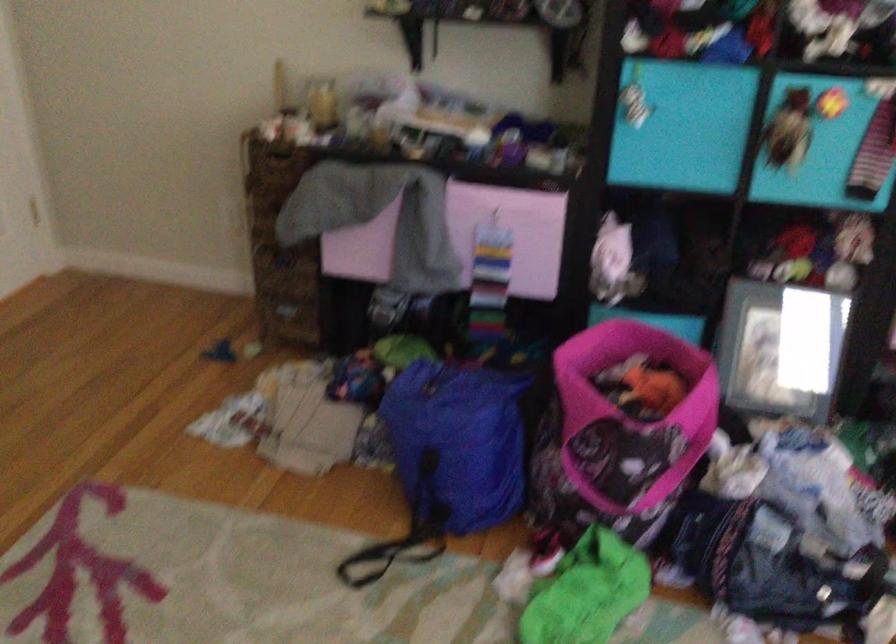
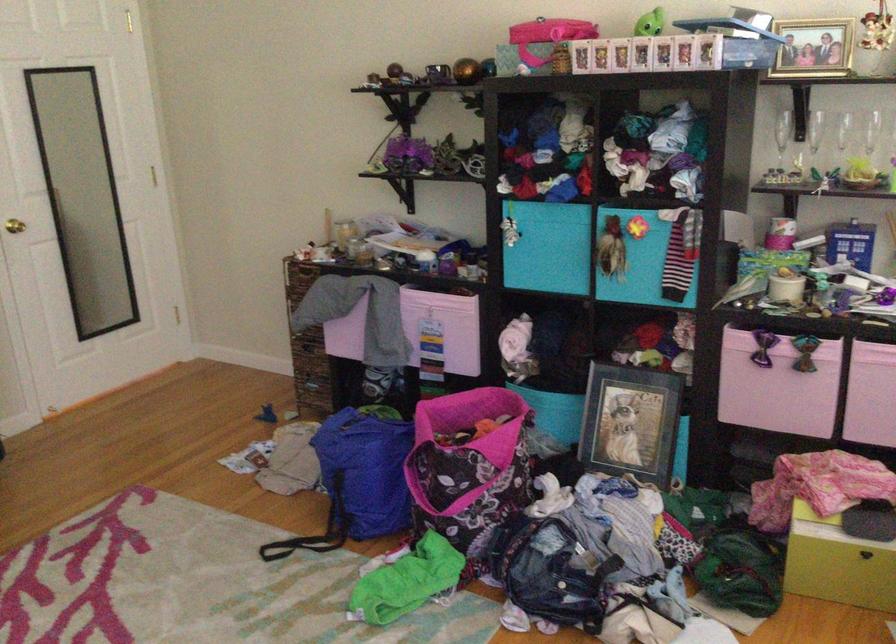
The point at (610, 486) is marked in the first image. Where is the corresponding point in the second image?

(440, 498)